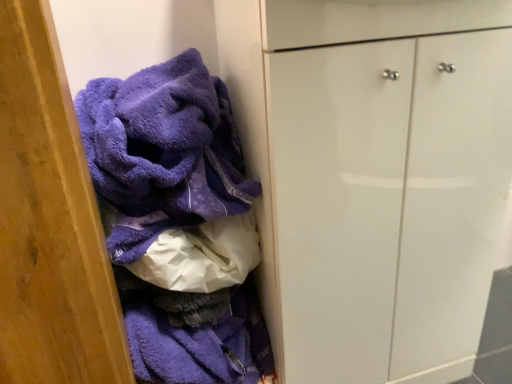
You are a GUI agent. You are given a task and a screenshot of the screen. Output one action in this format:
    pyautogui.click(x=<x>, y=<y>)
    Task: Click on the white glossy cabinet at center
    This screenshot has width=512, height=384.
    Given the screenshot: What is the action you would take?
    pyautogui.click(x=375, y=177)

What do you see at coordinates (375, 177) in the screenshot?
I see `white glossy cabinet at center` at bounding box center [375, 177].

Where is `white glossy cabinet at center`? This screenshot has height=384, width=512. white glossy cabinet at center is located at coordinates (375, 177).